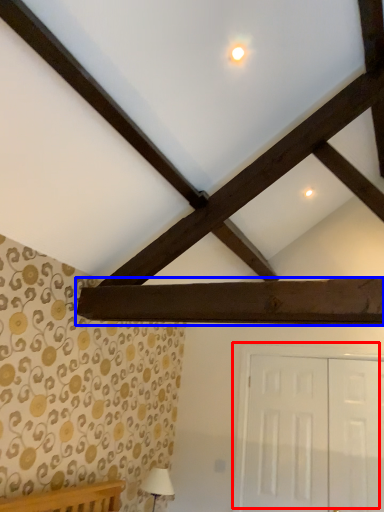
Question: Which point is closer to the camera, door (highlighted by a red box) or plank (highlighted by a blue box)?

Choices:
 (A) door
 (B) plank

Answer: (B)